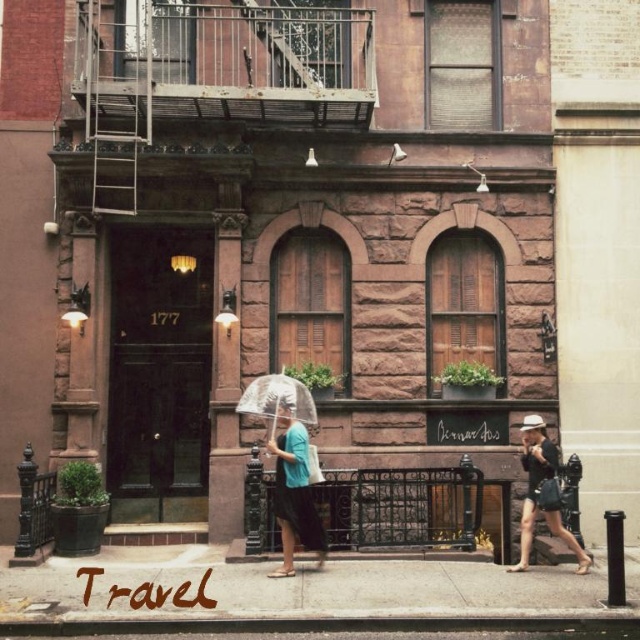
Question: Which point appears farthest from the camera in this image?

Choices:
 (A) (202, 572)
 (B) (321, 522)
 (C) (284, 412)

Answer: (A)

Question: Which of the following is the closest to the observer?

Choices:
 (A) (545, 460)
 (B) (289, 612)
 (C) (273, 452)

Answer: (B)

Question: Can you confirm if matte blue shirt at center is wider than transparent plastic umbrella at center?

Choices:
 (A) no
 (B) yes

Answer: (A)

Question: Is smooth concrete pavement at center to the right of transparent plastic umbrella at center from the viewer's perspective?

Choices:
 (A) yes
 (B) no

Answer: (B)

Question: Which point is closer to the camera taking this photo?

Choices:
 (A) tap(252, 388)
 (B) tap(544, 440)

Answer: (A)

Question: Is smooth concrete pavement at center to the left of transparent plastic umbrella at center from the viewer's perspective?

Choices:
 (A) yes
 (B) no

Answer: (A)